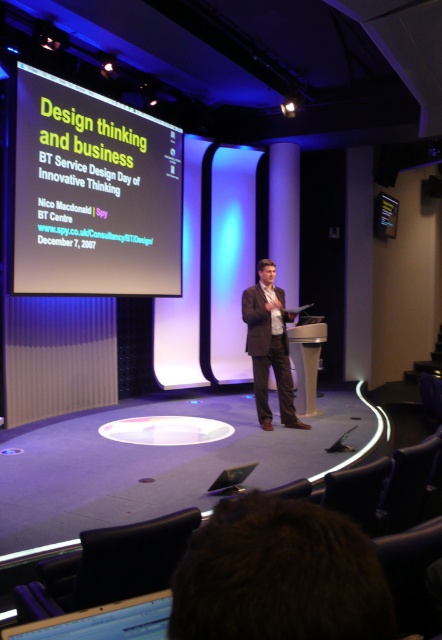
Looking at this image, who is more forward, (99, 236) or (281, 410)?

Positioned in front is point (281, 410).

From the picture: Is matte white projector screen at upper left bigger than brown leather jacket at center?

Yes, matte white projector screen at upper left is bigger than brown leather jacket at center.

Between point (57, 176) and point (271, 296), which one is positioned in front?

Positioned in front is point (57, 176).

The height and width of the screenshot is (640, 442). In order to click on matte white projector screen at upper left in this screenshot , I will do `click(92, 193)`.